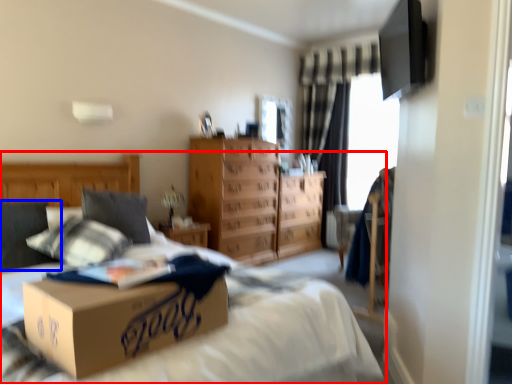
Question: Which object is further to the camera taking this photo, bed (highlighted by a red box) or pillow (highlighted by a blue box)?

Choices:
 (A) bed
 (B) pillow

Answer: (B)